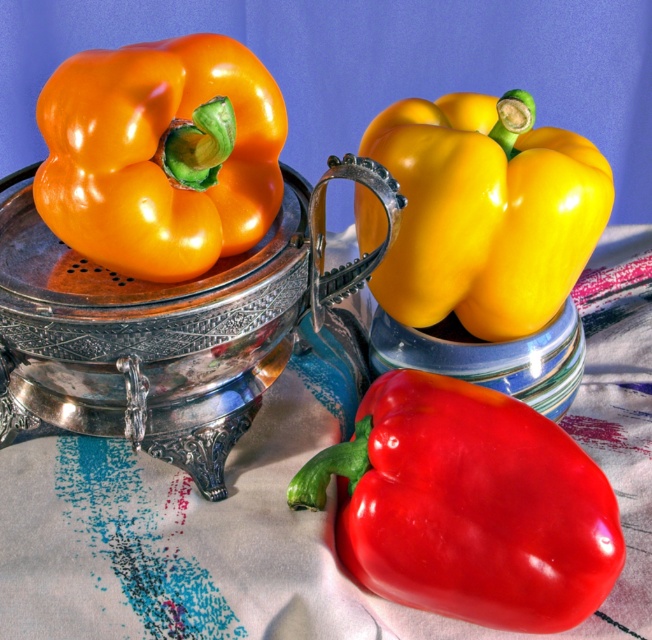
Question: Is glossy red bell pepper at lower center to the left of yellow glossy bell pepper at center from the viewer's perspective?

Choices:
 (A) yes
 (B) no

Answer: (A)

Question: Which object is the farthest from the yellow glossy bell pepper at center?

Choices:
 (A) orange glossy bell pepper at upper left
 (B) glossy red bell pepper at lower center

Answer: (B)

Question: Is glossy red bell pepper at lower center below orange glossy bell pepper at upper left?

Choices:
 (A) yes
 (B) no

Answer: (A)

Question: Does glossy red bell pepper at lower center appear on the left side of yellow glossy bell pepper at center?

Choices:
 (A) no
 (B) yes

Answer: (B)

Question: Which point is farther to the camera?

Choices:
 (A) (441, 464)
 (B) (527, 124)
 (C) (183, 157)

Answer: (B)

Question: Which object appears farthest from the camera in this image?

Choices:
 (A) yellow glossy bell pepper at center
 (B) orange glossy bell pepper at upper left

Answer: (A)